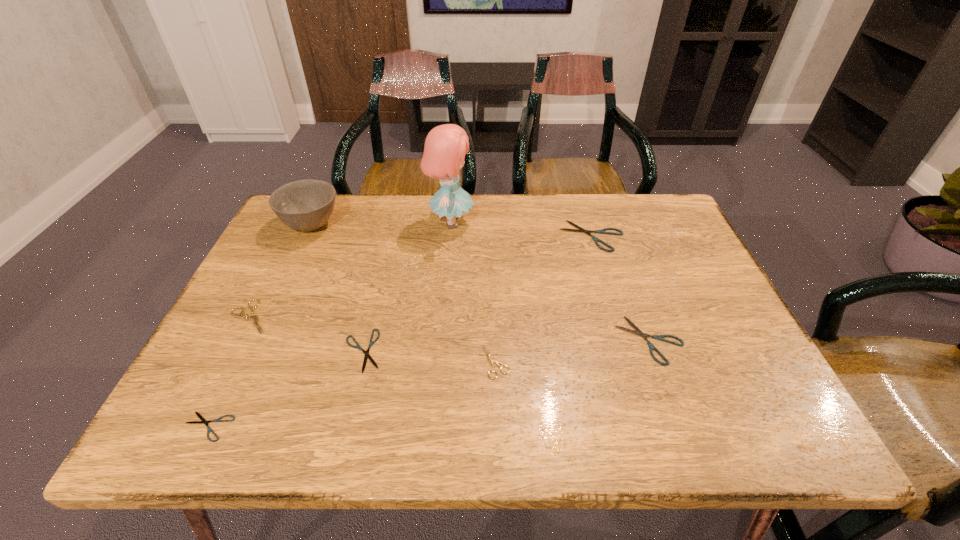
The width and height of the screenshot is (960, 540). In the image, there is a desktop. Find the location of `free space at the far edge`. free space at the far edge is located at coordinates (554, 197).

This screenshot has width=960, height=540. I want to click on vacant area at the near edge of the desktop, so click(502, 442).

The width and height of the screenshot is (960, 540). Find the location of `vacant space at the left edge`. vacant space at the left edge is located at coordinates (270, 263).

The height and width of the screenshot is (540, 960). What are the coordinates of `free space at the right edge` in the screenshot? It's located at (664, 320).

The width and height of the screenshot is (960, 540). What are the coordinates of `vacant space at the far left corner of the desktop` in the screenshot? It's located at (319, 235).

The width and height of the screenshot is (960, 540). I want to click on free space at the near right corner of the desktop, so click(x=751, y=430).

The height and width of the screenshot is (540, 960). I want to click on free space between the right beige shears and the farthest shears, so click(x=543, y=299).

Identify the location of free point between the nearest shears and the second black shears from left to right. The width and height of the screenshot is (960, 540). (285, 389).

This screenshot has width=960, height=540. I want to click on blank region between the seventh shortest object and the fifth object from right to left, so click(x=337, y=288).

I want to click on free space between the fifth object from left to right and the nearest black shears, so click(329, 325).